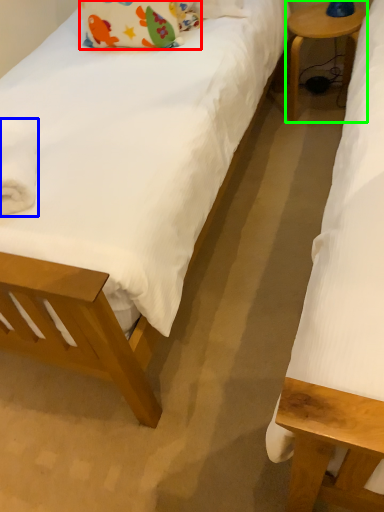
Question: Which object is the farthest from pillow (highlighted by a red box)? Choose among these: material (highlighted by a blue box) or table (highlighted by a green box).

Choices:
 (A) material
 (B) table

Answer: (A)